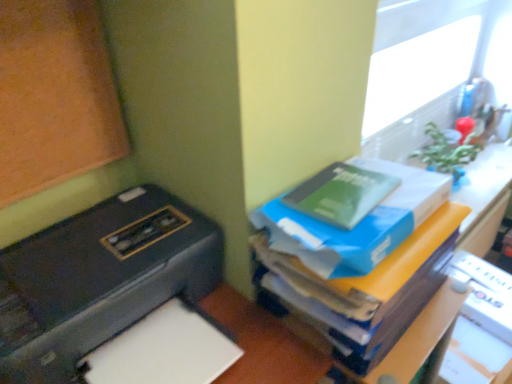
This screenshot has height=384, width=512. What are the coordinates of `vacant region above black plastic printer at left (from a real-world perspective)` in the screenshot? It's located at (99, 245).